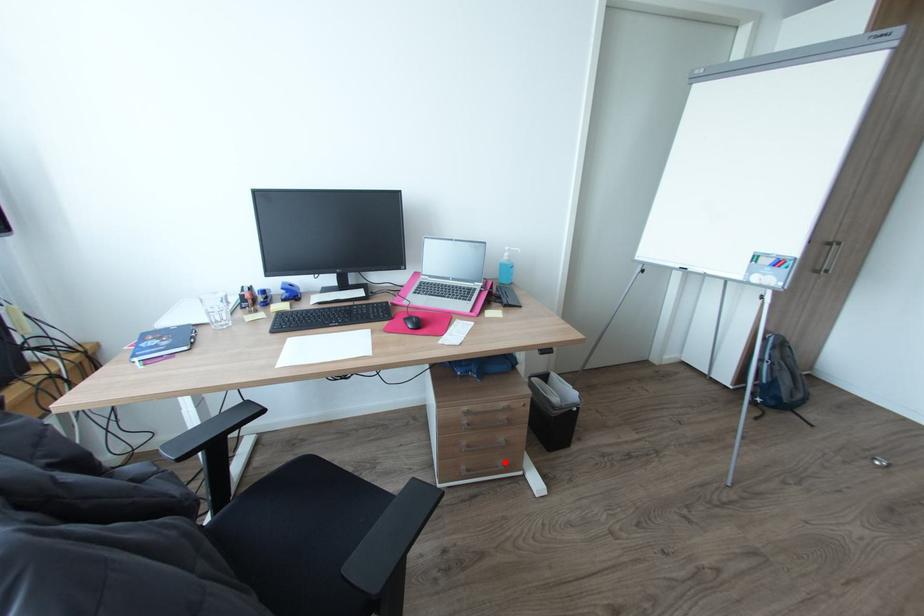
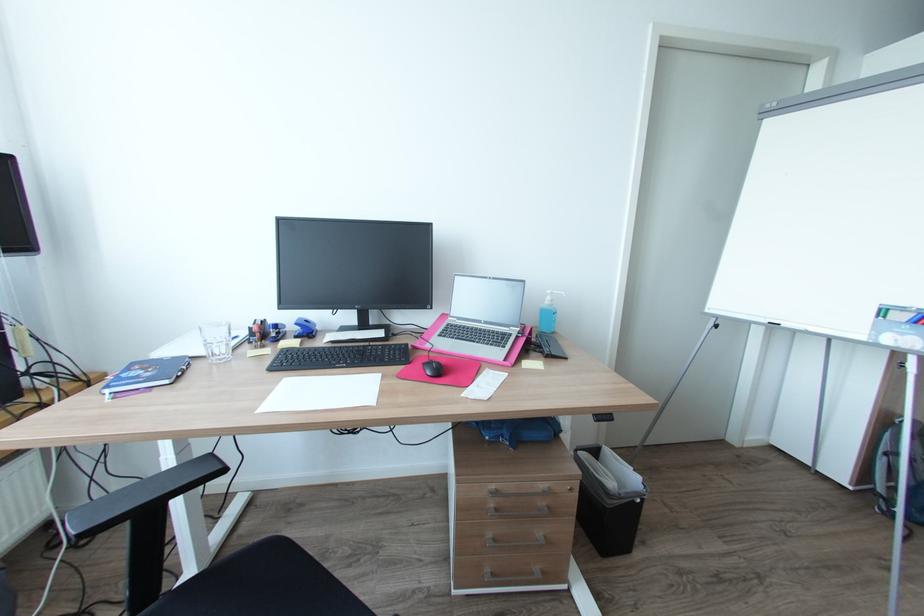
Locate, in the second image, the point that corresponds to the highlighted location in the first image.

(541, 569)